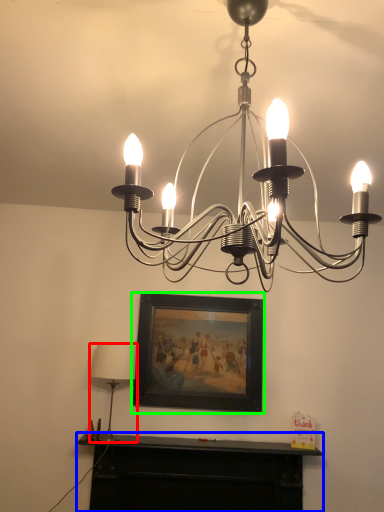
Question: Which object is positioned closest to lamp (highlighted by a red box)? Select from furniture (highlighted by a blue box) and picture frame (highlighted by a green box).

Choices:
 (A) furniture
 (B) picture frame

Answer: (B)